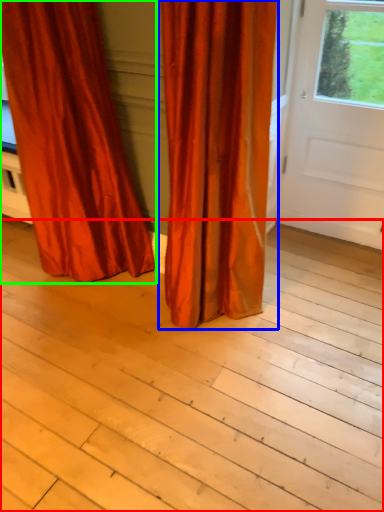
Question: Which is nearer to the plank (highlighted by a red box)? curtain (highlighted by a blue box) or curtain (highlighted by a green box).

Choices:
 (A) curtain
 (B) curtain

Answer: (A)